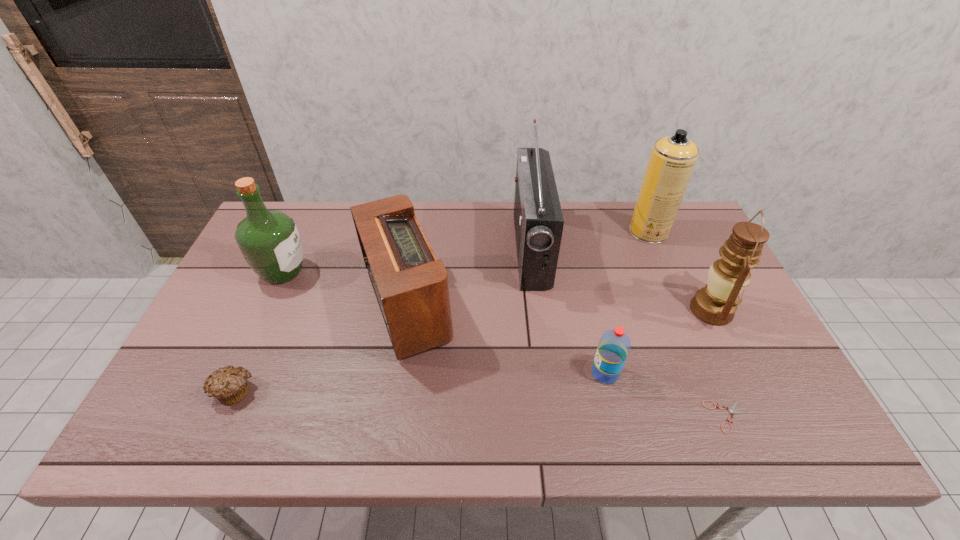
Where is `vacant space that's between the muffin and the shortest object`? This screenshot has width=960, height=540. vacant space that's between the muffin and the shortest object is located at coordinates (481, 404).

You are a GUI agent. You are given a task and a screenshot of the screen. Output one action in this format:
    pyautogui.click(x=<x>, y=<y>)
    Task: Click on the vacant area that lies between the fourth shortest object and the second shortest object
    The image size is (960, 540).
    Given the screenshot: What is the action you would take?
    pyautogui.click(x=320, y=349)

Locate an element on the screen. vacant area that lies between the aerosol can and the taller radio receiver is located at coordinates (589, 241).

In order to click on empty space that is in between the oil lamp and the liquor in this screenshot , I will do `click(497, 291)`.

Locate an element on the screen. free space between the liquor and the shortest object is located at coordinates (506, 345).

Identify the location of unoccupied position between the liquor and the oil lamp. This screenshot has width=960, height=540. (497, 291).

Identify the location of free space that is in between the fourth shortest object and the liquor. click(345, 289).

At what (x,y) coordinates should I click in order to perform the action: click on object that stands as the closest to the water bottle. Please return your answer as a coordinate pair (x, y). This screenshot has width=960, height=540. Looking at the image, I should click on (731, 410).

Identify the location of the fifth closest object to the water bottle. (672, 160).

Identify the location of free space in the image that satisfies the following two spatial constraints: 1. on the front-facing side of the liquor; 2. on the right side of the shears. Image resolution: width=960 pixels, height=540 pixels. (218, 417).